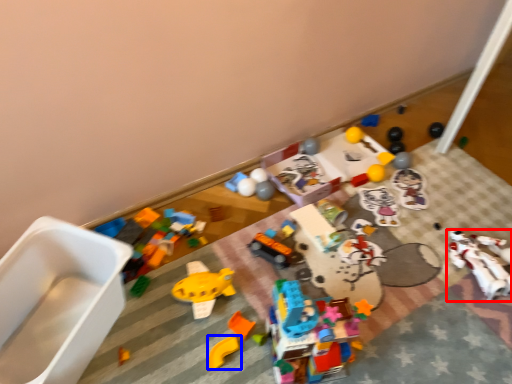
Question: Among these objects, which one is farthest to the camera, toy (highlighted by a red box) or toy (highlighted by a blue box)?

Choices:
 (A) toy
 (B) toy

Answer: (A)